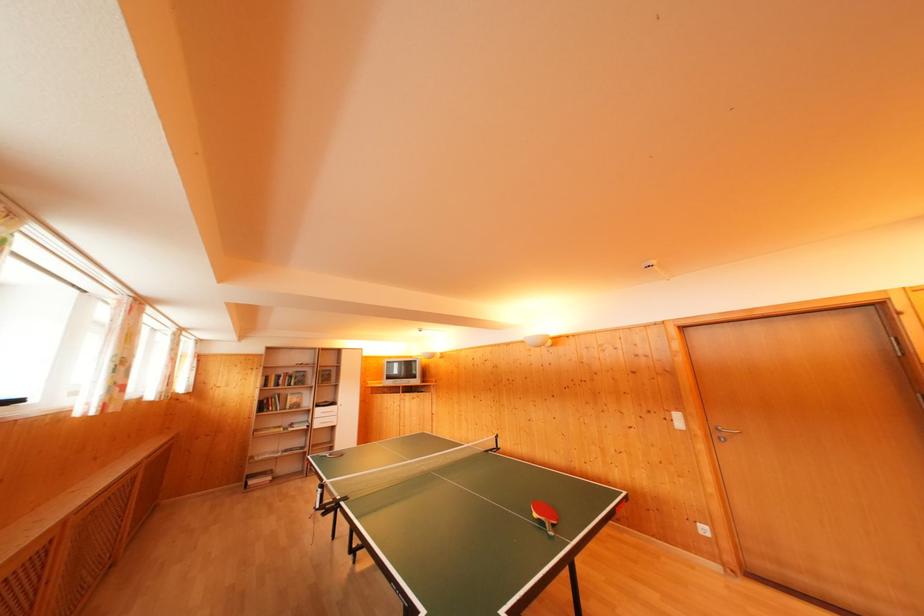
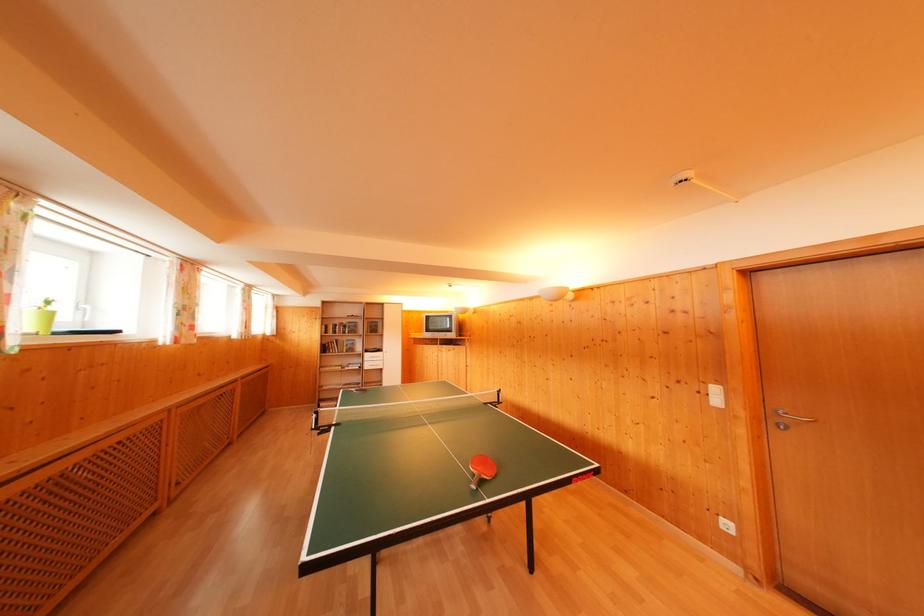
The point at (296, 376) is marked in the first image. Where is the corresponding point in the second image?

(349, 326)